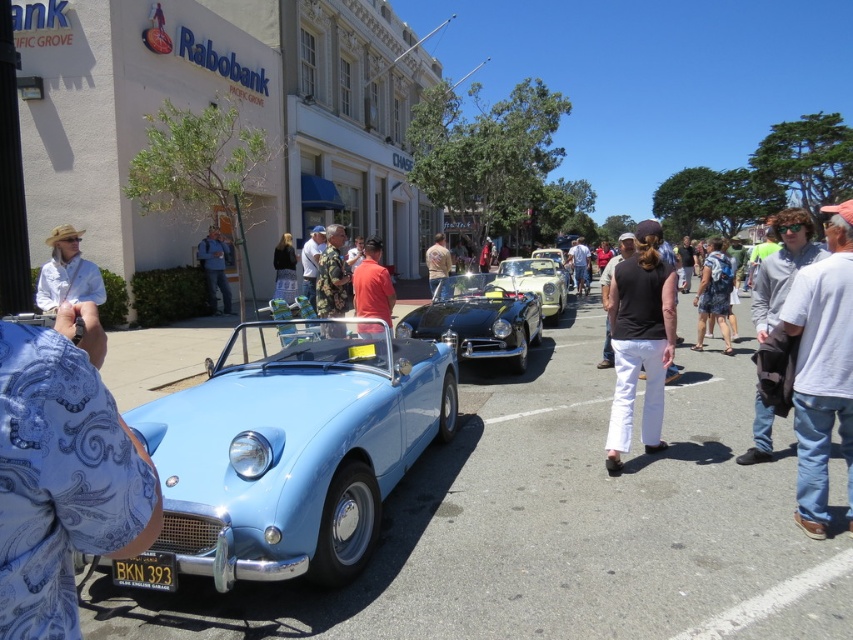
Question: Can you confirm if blue paisley shirt at lower left is positioned above blue denim jeans at center?

Choices:
 (A) no
 (B) yes

Answer: (A)

Question: Considering the real-world distances, which object is farthest from the denim jacket at right?

Choices:
 (A) blue backpack at center
 (B) black matte shirt at center

Answer: (B)

Question: Can you confirm if black matte shirt at center is wider than camouflage fabric jacket at center?

Choices:
 (A) no
 (B) yes

Answer: (A)

Question: Estimate the real-world distances between objects in this image. Which object is closer to the camouflage fabric jacket at center?

Choices:
 (A) metallic gold convertible at center
 (B) black cotton shirt at center
 (C) brown leather jacket at center

Answer: (C)

Question: In this image, where is light blue metallic car at center-left located relative to blue denim jeans at center?

Choices:
 (A) left
 (B) right

Answer: (B)

Question: Which of the following is the closest to the observer?

Choices:
 (A) (851, 508)
 (B) (579, 280)
 (C) (361, 326)
 (D) (799, 248)

Answer: (A)